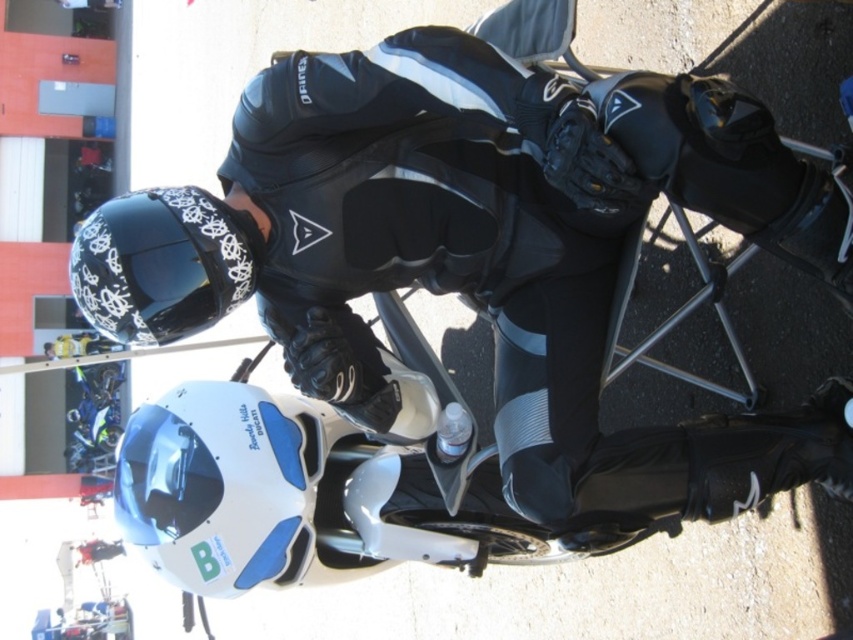
You are a photographer taking a picture of the black leather motorcycle rider at center and the black glossy helmet at upper left. Which object should you focus on first if you want to capture both in the frame without moving the camera?

The black leather motorcycle rider at center is bigger than the black glossy helmet at upper left, so you should focus on the black leather motorcycle rider at center first to ensure it is in clear view before adjusting for the smaller helmet.

You are a photographer at a motorcycle event. You need to capture a photo of the black leather motorcycle rider at center and the white matte helmet at lower center. Which object is wider in the image?

The black leather motorcycle rider at center is wider than the white matte helmet at lower center according to the description provided.

You are a photographer trying to capture both the white matte helmet at lower center and the black glossy helmet at upper left in a single frame. Based on their positions and sizes, which helmet will appear larger in the photo?

The white matte helmet at lower center will appear larger in the photo because it is much taller than the black glossy helmet at upper left.